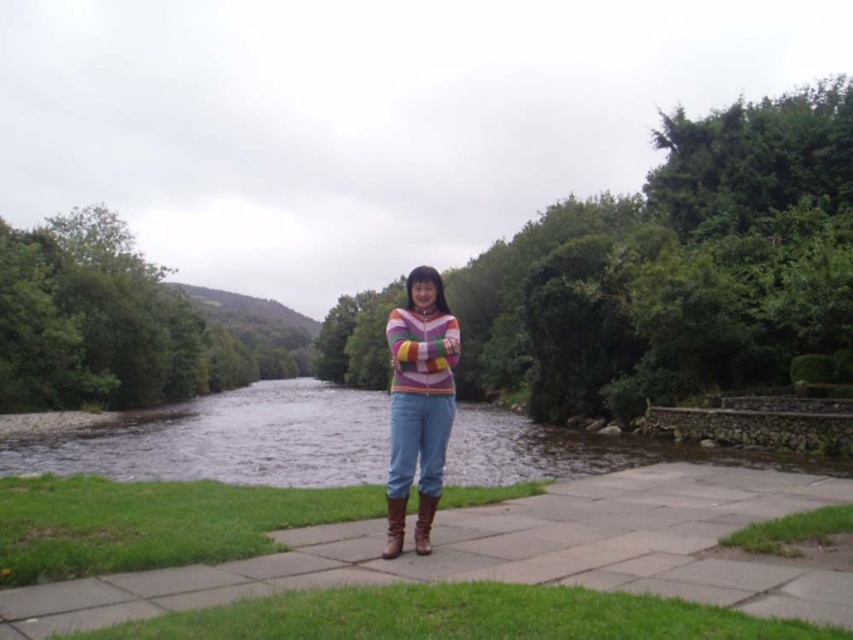
You are a hiker who wants to set up a tent. You have a tent that requires a 3x3 meter area. Looking at the scene, can you determine if the brown leather pavement at center or the green soft grass at lower right can accommodate your tent?

The brown leather pavement at center has a larger size compared to green soft grass at lower right. Therefore, the brown leather pavement at center is more likely to accommodate the tent requiring a 3x3 meter area.